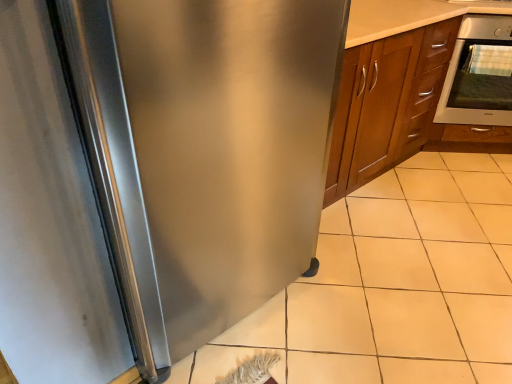
Question: From the image's perspective, is white tile at lower right on stainless steel refrigerator at left?

Choices:
 (A) yes
 (B) no

Answer: (B)

Question: Is white tile at lower right completely or partially outside of stainless steel refrigerator at left?

Choices:
 (A) no
 (B) yes

Answer: (B)

Question: Is white tile at lower right taller than stainless steel refrigerator at left?

Choices:
 (A) no
 (B) yes

Answer: (A)

Question: Is white tile at lower right bigger than stainless steel refrigerator at left?

Choices:
 (A) no
 (B) yes

Answer: (A)

Question: Is white tile at lower right oriented away from stainless steel refrigerator at left?

Choices:
 (A) no
 (B) yes

Answer: (A)

Question: Does white tile at lower right come behind stainless steel refrigerator at left?

Choices:
 (A) no
 (B) yes

Answer: (B)

Question: Is white tile at lower right positioned behind satin silver oven at upper right?

Choices:
 (A) yes
 (B) no

Answer: (B)

Question: Considering the relative sizes of white tile at lower right and satin silver oven at upper right in the image provided, is white tile at lower right bigger than satin silver oven at upper right?

Choices:
 (A) yes
 (B) no

Answer: (A)

Question: From the image's perspective, would you say white tile at lower right is shown under satin silver oven at upper right?

Choices:
 (A) no
 (B) yes

Answer: (B)

Question: Can you confirm if white tile at lower right is thinner than satin silver oven at upper right?

Choices:
 (A) no
 (B) yes

Answer: (A)

Question: From a real-world perspective, is white tile at lower right positioned over satin silver oven at upper right based on gravity?

Choices:
 (A) no
 (B) yes

Answer: (A)

Question: Considering the relative sizes of white tile at lower right and satin silver oven at upper right in the image provided, is white tile at lower right shorter than satin silver oven at upper right?

Choices:
 (A) no
 (B) yes

Answer: (B)

Question: Does stainless steel refrigerator at left touch satin silver oven at upper right?

Choices:
 (A) yes
 (B) no

Answer: (B)